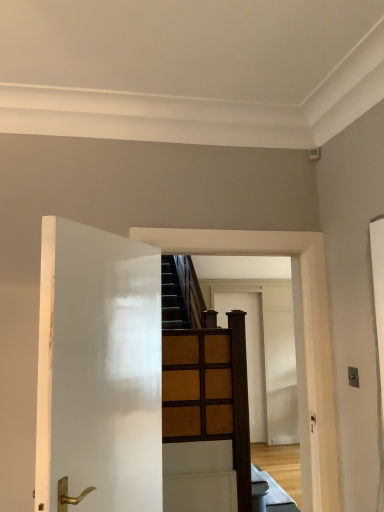
Question: Is point (152, 432) positioned closer to the camera than point (220, 311)?

Choices:
 (A) farther
 (B) closer

Answer: (B)

Question: From the image's perspective, is white glossy door at left, which ranks as the first door in left-to-right order, positioned above or below brown wooden door at center, the second door positioned from the front?

Choices:
 (A) above
 (B) below

Answer: (A)

Question: Looking at their shapes, would you say white glossy door at left, which is counted as the second door, starting from the back, is wider or thinner than brown wooden door at center, the second door positioned from the front?

Choices:
 (A) thin
 (B) wide

Answer: (B)

Question: From the image's perspective, is brown wooden door at center, the 1th door viewed from the right, above or below white glossy door at left, the second door in the right-to-left sequence?

Choices:
 (A) above
 (B) below

Answer: (B)

Question: From a real-world perspective, is brown wooden door at center, the second door positioned from the front, above or below white glossy door at left, which is counted as the second door, starting from the back?

Choices:
 (A) below
 (B) above

Answer: (A)

Question: In terms of width, does brown wooden door at center, arranged as the 1th door when viewed from the back, look wider or thinner when compared to white glossy door at left, the second door in the right-to-left sequence?

Choices:
 (A) thin
 (B) wide

Answer: (A)

Question: Visually, is brown wooden door at center, the second door positioned from the front, positioned to the left or to the right of white glossy door at left, which ranks as the first door in left-to-right order?

Choices:
 (A) right
 (B) left

Answer: (A)